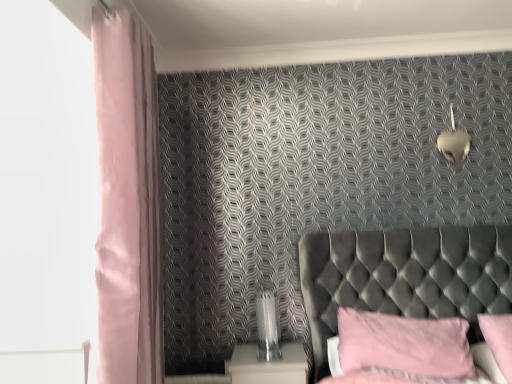
Question: Relative to white glossy nightstand at lower center, is metallic heart-shaped light fixture at upper right in front or behind?

Choices:
 (A) behind
 (B) front

Answer: (A)

Question: From the image's perspective, is metallic heart-shaped light fixture at upper right located above or below white glossy nightstand at lower center?

Choices:
 (A) below
 (B) above

Answer: (B)

Question: Estimate the real-world distances between objects in this image. Which object is closer to the pink fabric pillow at lower right, marked as the 1th pillow in a right-to-left arrangement?

Choices:
 (A) matte pink curtain at left
 (B) white glossy nightstand at lower center
 (C) clear glass table lamp at center
 (D) tufted velvet headboard at right
 (E) metallic heart-shaped light fixture at upper right

Answer: (D)

Question: Estimate the real-world distances between objects in this image. Which object is farther from the white glossy nightstand at lower center?

Choices:
 (A) clear glass table lamp at center
 (B) matte pink curtain at left
 (C) pink fabric pillow at lower right, the second pillow viewed from the right
 (D) pink fabric pillow at lower right, placed as the second pillow when sorted from left to right
 (E) metallic heart-shaped light fixture at upper right

Answer: (E)